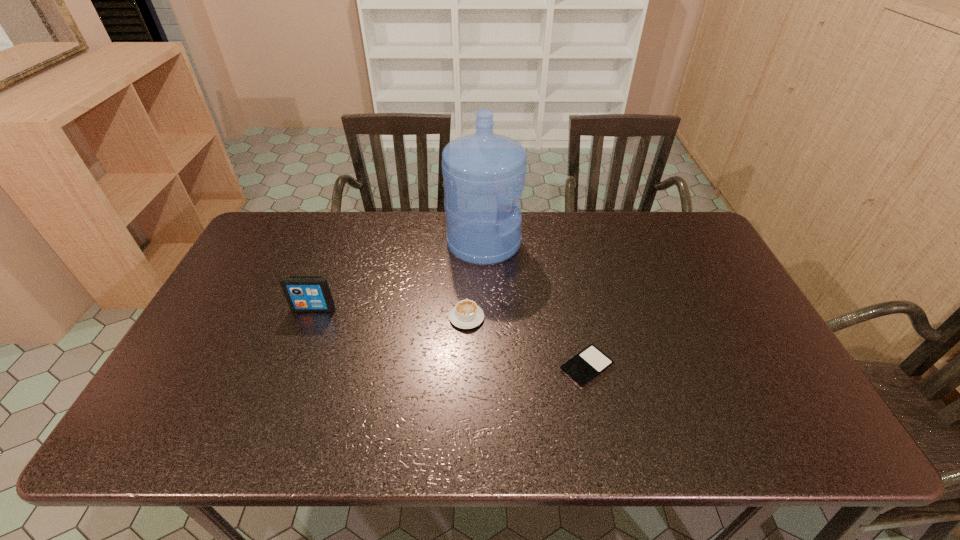
At what (x,y) coordinates should I click in order to perform the action: click on vacant region located 0.380m on the side of the second shortest object with the handle. Please return your answer as a coordinate pair (x, y). Looking at the image, I should click on (469, 226).

Where is `vacant region located 0.350m on the side of the second shortest object with the handle`? Image resolution: width=960 pixels, height=540 pixels. vacant region located 0.350m on the side of the second shortest object with the handle is located at coordinates (469, 231).

This screenshot has width=960, height=540. In order to click on vacant space located 0.070m on the right of the nearer iPod in this screenshot , I will do `click(642, 367)`.

Identify the location of object that is at the far edge. (484, 173).

Locate an element on the screen. free region at the far edge is located at coordinates coord(425,246).

In the image, there is a desktop. Identify the location of vacant space at the near edge. (510, 418).

The image size is (960, 540). Identify the location of free region at the left edge of the desktop. click(x=181, y=373).

The image size is (960, 540). In the image, there is a desktop. In order to click on vacant space at the right edge in this screenshot , I will do `click(707, 288)`.

Locate an element on the screen. Image resolution: width=960 pixels, height=540 pixels. vacant area at the near left corner of the desktop is located at coordinates (200, 447).

Find the location of a particular element. Image resolution: width=960 pixels, height=540 pixels. vacant area that lies between the shorter iPod and the third tallest object is located at coordinates (527, 342).